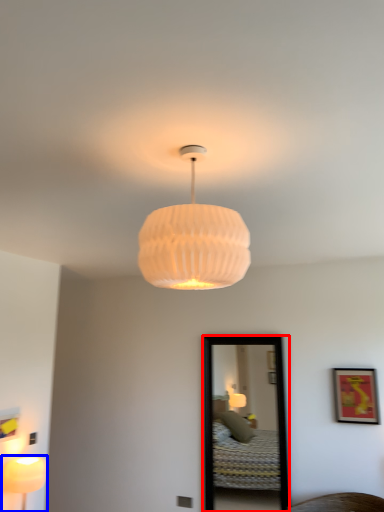
Question: Which of the following is the closest to the observer, mirror (highlighted by a red box) or lamp (highlighted by a blue box)?

Choices:
 (A) mirror
 (B) lamp

Answer: (B)